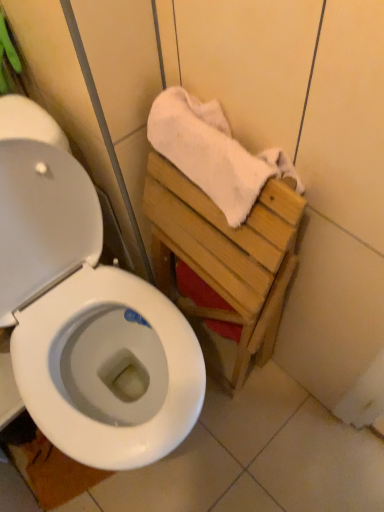
This screenshot has height=512, width=384. What are the coordinates of `unoccupied region to the right of white glossy toilet seat at lower left` in the screenshot? It's located at (160, 477).